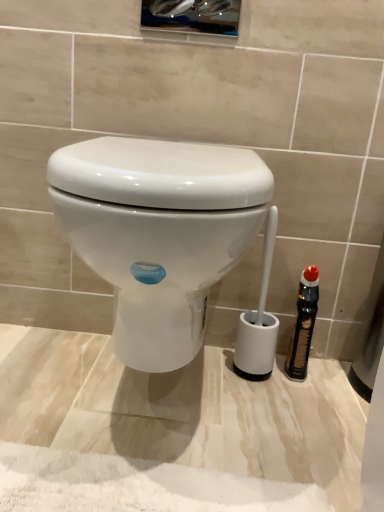
Question: Looking at their shapes, would you say black plastic bottle at right is wider or thinner than white glossy toilet at center?

Choices:
 (A) thin
 (B) wide

Answer: (A)

Question: Does point (304, 309) appear closer or farther from the camera than point (263, 282)?

Choices:
 (A) closer
 (B) farther

Answer: (A)

Question: Based on their sizes in the image, would you say black plastic bottle at right is bigger or smaller than white glossy toilet at center?

Choices:
 (A) small
 (B) big

Answer: (A)

Question: Based on their sizes in the image, would you say white glossy toilet at center is bigger or smaller than black plastic bottle at right?

Choices:
 (A) big
 (B) small

Answer: (A)

Question: From a real-world perspective, is white glossy toilet at center above or below black plastic bottle at right?

Choices:
 (A) above
 (B) below

Answer: (A)

Question: Considering the relative positions of white glossy toilet at center and black plastic bottle at right in the image provided, is white glossy toilet at center to the left or to the right of black plastic bottle at right?

Choices:
 (A) left
 (B) right

Answer: (A)

Question: Is white glossy toilet at center in front of or behind black plastic bottle at right in the image?

Choices:
 (A) front
 (B) behind

Answer: (A)